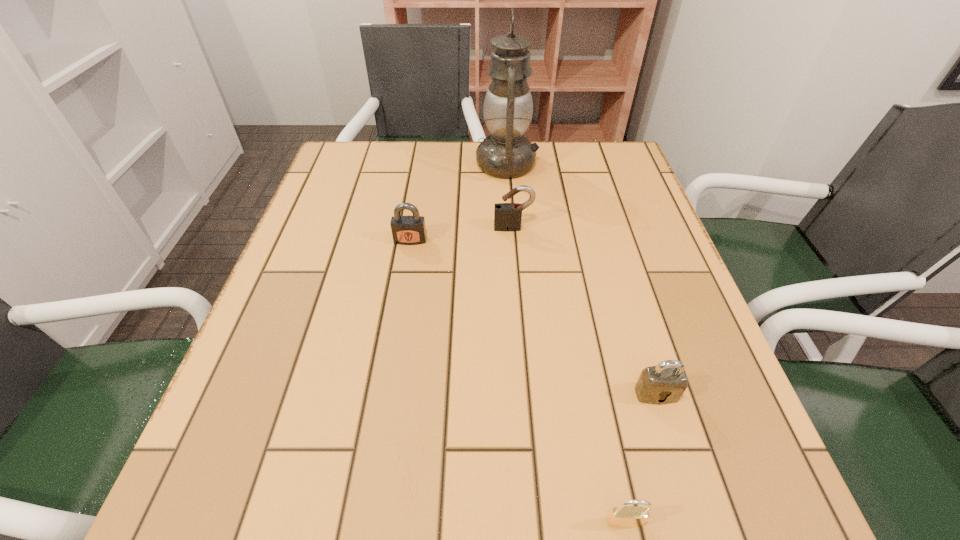
The width and height of the screenshot is (960, 540). In order to click on the fourth closest object to the third nearest object in this screenshot , I will do [623, 516].

Point out which object is positioned as the nearest to the third farthest padlock. Please provide its 2D coordinates. Your answer should be formatted as a tuple, i.e. [(x, y)], where the tuple contains the x and y coordinates of a point satisfying the conditions above.

[(623, 516)]

What are the coordinates of `the second closest padlock to the leftmost padlock` in the screenshot? It's located at (665, 383).

Point out which padlock is positioned as the second nearest to the second object from right to left. Please provide its 2D coordinates. Your answer should be formatted as a tuple, i.e. [(x, y)], where the tuple contains the x and y coordinates of a point satisfying the conditions above.

[(507, 216)]